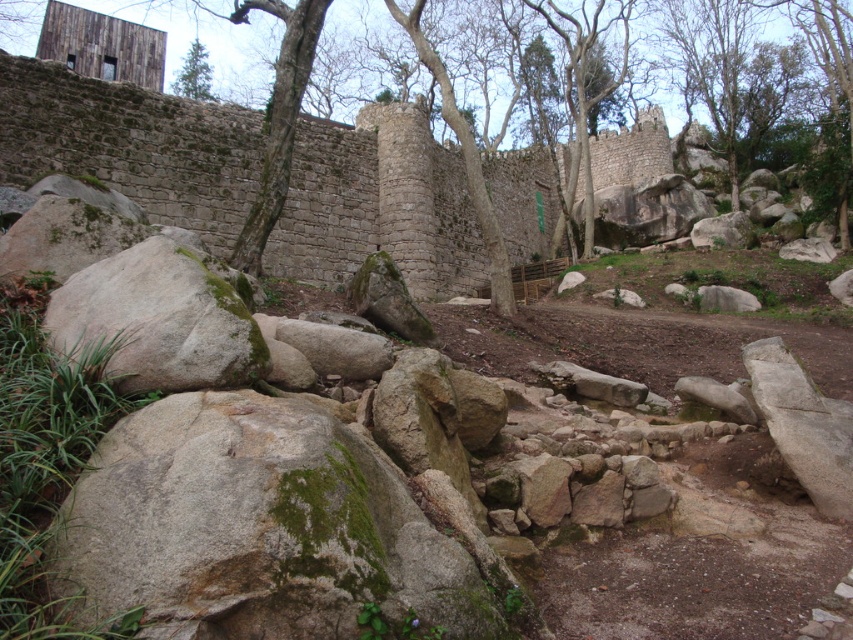
The image size is (853, 640). What do you see at coordinates (158, 321) in the screenshot?
I see `green mossy rock at lower left` at bounding box center [158, 321].

Is green mossy rock at lower left to the left of green matte tree at upper left from the viewer's perspective?

Incorrect, green mossy rock at lower left is not on the left side of green matte tree at upper left.

This screenshot has height=640, width=853. I want to click on green mossy rock at lower left, so click(x=158, y=321).